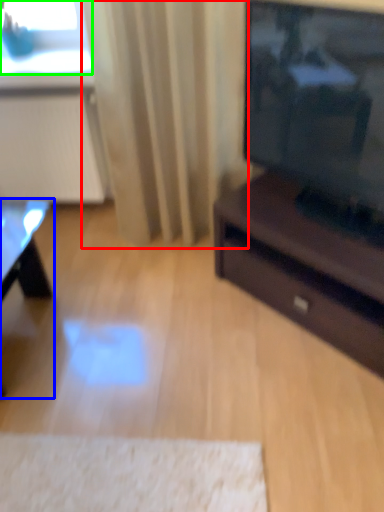
Question: Which is farther away from curtain (highlighted by a red box)? table (highlighted by a blue box) or window screen (highlighted by a green box)?

Choices:
 (A) table
 (B) window screen

Answer: (A)